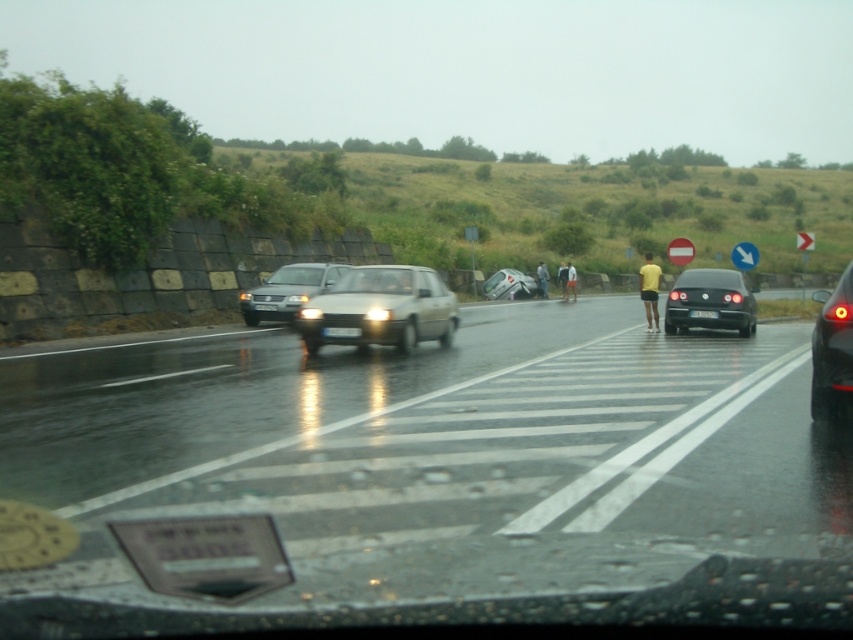
Question: Which object is positioned closest to the yellow matte shorts at center?

Choices:
 (A) black plastic license plate at center
 (B) satin beige sedan at center
 (C) shiny metallic car at center

Answer: (A)

Question: Can you confirm if shiny metallic car at center is positioned to the right of yellow matte shirt at center?

Choices:
 (A) yes
 (B) no

Answer: (B)

Question: Among these objects, which one is farthest from the camera?

Choices:
 (A) yellow matte shorts at center
 (B) shiny black sedan at center

Answer: (B)

Question: Can you confirm if satin beige sedan at center is positioned to the left of black plastic license plate at center?

Choices:
 (A) yes
 (B) no

Answer: (A)

Question: Based on their relative distances, which object is nearer to the metallic silver sedan at center?

Choices:
 (A) yellow matte shorts at center
 (B) black plastic license plate at center
 (C) silver metallic sedan at center

Answer: (A)

Question: Can you confirm if shiny black sedan at center is positioned to the left of black plastic license plate at center?

Choices:
 (A) no
 (B) yes

Answer: (A)